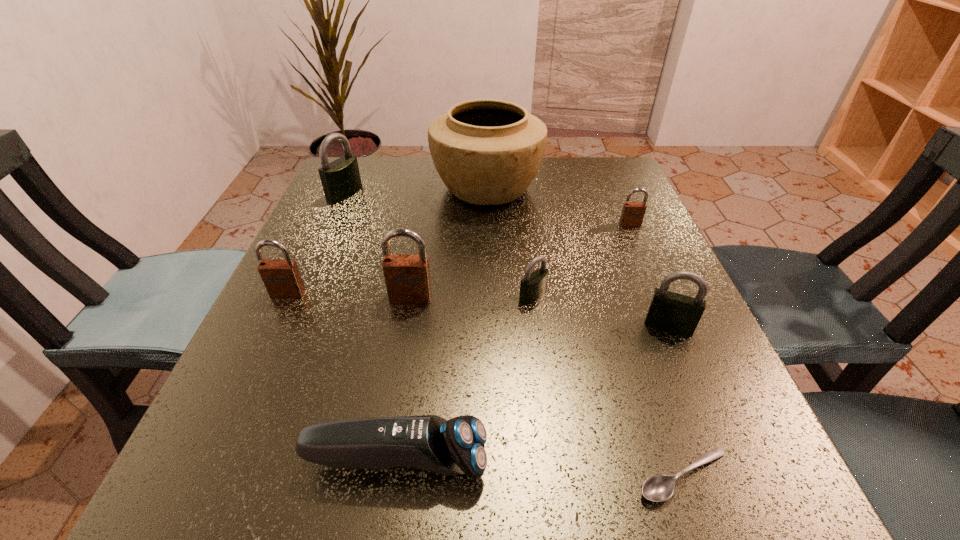
You are a GUI agent. You are given a task and a screenshot of the screen. Output one action in this format:
    pyautogui.click(x=<x>, y=<y>)
    Task: Click on the pottery
    
    Given the screenshot: What is the action you would take?
    pyautogui.click(x=487, y=152)

At what (x,y) coordinates should I click in order to perform the action: click on the farthest black padlock. Please return your answer as a coordinate pair (x, y). Looking at the image, I should click on click(x=340, y=179).

You are a GUI agent. You are given a task and a screenshot of the screen. Output one action in this format:
    pyautogui.click(x=<x>, y=<y>)
    Task: Click on the leftmost black padlock
    The width and height of the screenshot is (960, 540).
    Given the screenshot: What is the action you would take?
    pyautogui.click(x=340, y=179)

I want to click on the second brown padlock from right to left, so click(407, 276).

This screenshot has width=960, height=540. Identify the location of the biggest brown padlock. (407, 276).

Identify the location of the nearest black padlock. (670, 312).

Where is `the second smallest black padlock`? the second smallest black padlock is located at coordinates (670, 312).

In order to click on the second smallest brown padlock in this screenshot , I will do `click(282, 279)`.

At what (x,y) coordinates should I click in order to perform the action: click on the fourth padlock from left to right. Please return your answer as a coordinate pair (x, y). Looking at the image, I should click on (533, 286).

I want to click on the smallest black padlock, so click(x=533, y=286).